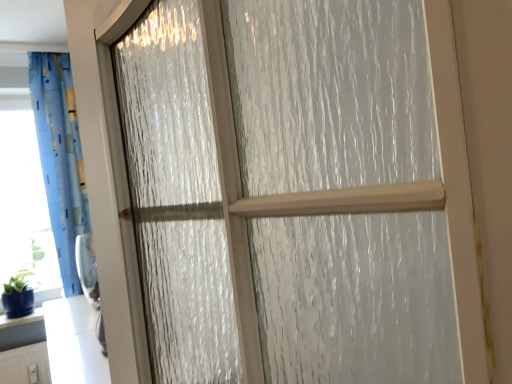
At what (x,y) coordinates should I click in order to perform the action: click on transparent plastic window screen at left. Please return your answer as a coordinate pair (x, y). The image size is (512, 384). Looking at the image, I should click on (25, 209).

This screenshot has height=384, width=512. What are the coordinates of `glass vase that is in front of the transparent plastic window screen at left` in the screenshot? It's located at (18, 303).

Considering the sizes of transparent plastic window screen at left and blue glossy vase at lower left in the image, is transparent plastic window screen at left bigger or smaller than blue glossy vase at lower left?

Clearly, transparent plastic window screen at left is larger in size than blue glossy vase at lower left.

Which of these two, transparent plastic window screen at left or blue glossy vase at lower left, is thinner?

transparent plastic window screen at left.

Is blue glossy vase at lower left completely or partially inside transparent plastic window screen at left?

No, blue glossy vase at lower left is not a part of transparent plastic window screen at left.

Are blue fabric curtain at left and blue glossy vase at lower left far apart?

No, blue fabric curtain at left is not far from blue glossy vase at lower left.

Considering the sizes of objects blue fabric curtain at left and blue glossy vase at lower left in the image provided, who is thinner, blue fabric curtain at left or blue glossy vase at lower left?

With smaller width is blue glossy vase at lower left.

From the picture: From a real-world perspective, which is physically below, blue fabric curtain at left or blue glossy vase at lower left?

From a 3D spatial view, blue glossy vase at lower left is below.

Is blue fabric curtain at left not inside blue glossy vase at lower left?

blue fabric curtain at left is positioned outside blue glossy vase at lower left.

Based on the photo, measure the distance between blue glossy vase at lower left and transparent plastic window screen at left.

blue glossy vase at lower left is 50.39 centimeters away from transparent plastic window screen at left.

Considering the sizes of objects blue glossy vase at lower left and transparent plastic window screen at left in the image provided, who is thinner, blue glossy vase at lower left or transparent plastic window screen at left?

Thinner between the two is transparent plastic window screen at left.

Is blue glossy vase at lower left with transparent plastic window screen at left?

No, blue glossy vase at lower left is not beside transparent plastic window screen at left.

Between blue glossy vase at lower left and transparent plastic window screen at left, which one appears on the right side from the viewer's perspective?

blue glossy vase at lower left is more to the right.

Which is more to the left, transparent plastic window screen at left or blue fabric curtain at left?

transparent plastic window screen at left.

Considering the relative sizes of transparent plastic window screen at left and blue fabric curtain at left in the image provided, is transparent plastic window screen at left wider than blue fabric curtain at left?

In fact, transparent plastic window screen at left might be narrower than blue fabric curtain at left.

Which object is closer to the camera, transparent plastic window screen at left or blue fabric curtain at left?

blue fabric curtain at left is in front.

The image size is (512, 384). What are the coordinates of `window screen below the blue fabric curtain at left (from a real-world perspective)` in the screenshot? It's located at (25, 209).

This screenshot has width=512, height=384. Find the location of `glass vase below the blue fabric curtain at left (from the image's perspective)`. glass vase below the blue fabric curtain at left (from the image's perspective) is located at coordinates (18, 303).

Can you confirm if blue glossy vase at lower left is taller than blue fabric curtain at left?

Incorrect, the height of blue glossy vase at lower left is not larger of that of blue fabric curtain at left.

Does blue glossy vase at lower left appear on the left side of blue fabric curtain at left?

Correct, you'll find blue glossy vase at lower left to the left of blue fabric curtain at left.

Who is taller, blue fabric curtain at left or transparent plastic window screen at left?

blue fabric curtain at left.

Does blue fabric curtain at left turn towards transparent plastic window screen at left?

No, blue fabric curtain at left is not aimed at transparent plastic window screen at left.

Relative to transparent plastic window screen at left, is blue fabric curtain at left in front or behind?

blue fabric curtain at left is positioned closer to the viewer than transparent plastic window screen at left.

This screenshot has height=384, width=512. I want to click on window screen behind the blue glossy vase at lower left, so click(25, 209).

This screenshot has width=512, height=384. In order to click on curtain located above the blue glossy vase at lower left (from a real-world perspective) in this screenshot , I will do `click(60, 157)`.

Considering their positions, is blue fabric curtain at left positioned closer to transparent plastic window screen at left than blue glossy vase at lower left?

Among the two, blue fabric curtain at left is located nearer to transparent plastic window screen at left.

Considering their positions, is transparent plastic window screen at left positioned closer to blue glossy vase at lower left than blue fabric curtain at left?

Based on the image, transparent plastic window screen at left appears to be nearer to blue glossy vase at lower left.

Estimate the real-world distances between objects in this image. Which object is further from blue glossy vase at lower left, blue fabric curtain at left or transparent plastic window screen at left?

Based on the image, blue fabric curtain at left appears to be further to blue glossy vase at lower left.

Based on the photo, from the image, which object appears to be farther from blue fabric curtain at left, blue glossy vase at lower left or transparent plastic window screen at left?

Based on the image, blue glossy vase at lower left appears to be further to blue fabric curtain at left.

Estimate the real-world distances between objects in this image. Which object is closer to blue fabric curtain at left, transparent plastic window screen at left or blue glossy vase at lower left?

transparent plastic window screen at left is closer to blue fabric curtain at left.

From the image, which object appears to be nearer to transparent plastic window screen at left, blue glossy vase at lower left or blue fabric curtain at left?

blue fabric curtain at left lies closer to transparent plastic window screen at left than the other object.

Where is `window screen between blue fabric curtain at left and blue glossy vase at lower left in the vertical direction`? window screen between blue fabric curtain at left and blue glossy vase at lower left in the vertical direction is located at coordinates (25, 209).